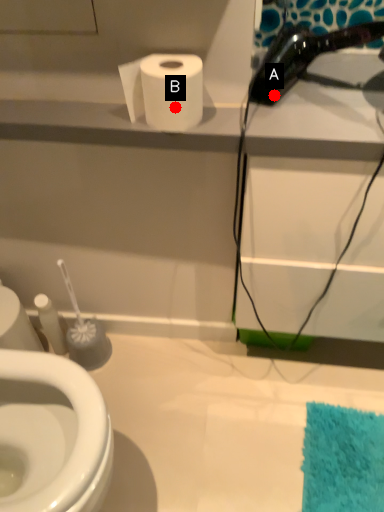
Question: Two points are circled on the image, labeled by A and B beside each circle. Among these points, which one is farthest from the camera?

Choices:
 (A) A is further
 (B) B is further

Answer: (A)